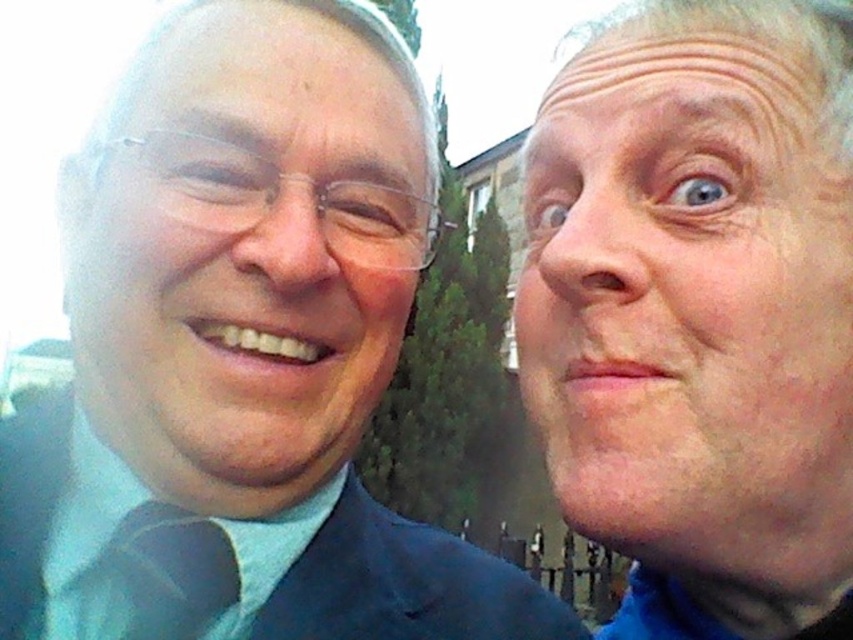
Consider the image. Between matte black face at left and dark blue fabric suit at left, which one has less height?

dark blue fabric suit at left

Between point (123, 445) and point (521, 580), which one is positioned behind?

Positioned behind is point (521, 580).

What do you see at coordinates (254, 248) in the screenshot? This screenshot has height=640, width=853. I see `matte black face at left` at bounding box center [254, 248].

Find the location of a particular element. This screenshot has width=853, height=640. matte black face at left is located at coordinates (254, 248).

Is pale skin at right wider than matte blue tie at left?

Indeed, pale skin at right has a greater width compared to matte blue tie at left.

Which of these two, pale skin at right or matte blue tie at left, stands shorter?

With less height is matte blue tie at left.

Is point (624, 525) behind point (90, 572)?

That is False.

Image resolution: width=853 pixels, height=640 pixels. In order to click on pale skin at right in this screenshot , I will do `click(689, 292)`.

Does dark blue fabric suit at left come behind matte blue tie at left?

That is False.

This screenshot has width=853, height=640. Describe the element at coordinates (405, 586) in the screenshot. I see `dark blue fabric suit at left` at that location.

Locate an element on the screen. The width and height of the screenshot is (853, 640). dark blue fabric suit at left is located at coordinates pyautogui.click(x=405, y=586).